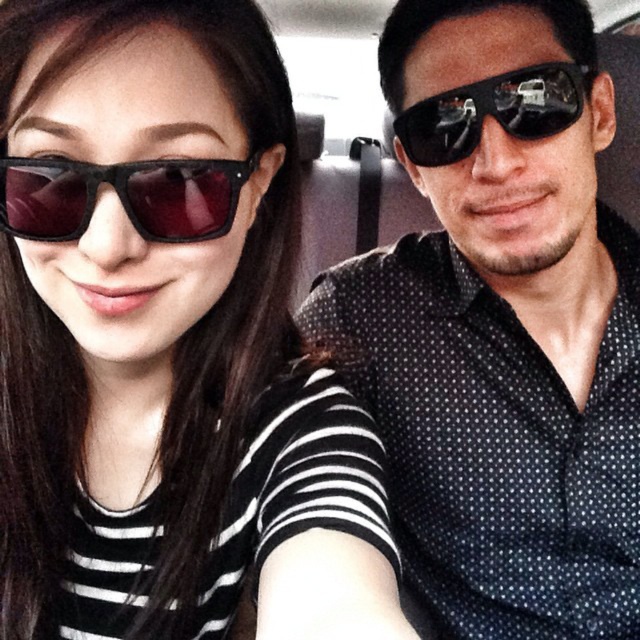
Question: Which point is farther from the camera taking this photo?

Choices:
 (A) (236, 179)
 (B) (563, 180)
 (C) (416, 128)

Answer: (C)

Question: Which point is closer to the camera taking this photo?

Choices:
 (A) (184, 214)
 (B) (88, 76)
 (C) (417, 273)

Answer: (B)

Question: Which point is farther to the camera?

Choices:
 (A) (509, 102)
 (B) (60, 186)

Answer: (A)

Question: Does matte black sunglasses at upper left have a smaller size compared to black reflective sunglasses at right?

Choices:
 (A) yes
 (B) no

Answer: (B)

Question: Does matte black sunglasses at upper right appear under matte black sunglasses at left?

Choices:
 (A) no
 (B) yes

Answer: (B)

Question: Does matte black sunglasses at upper left appear under black reflective sunglasses at right?

Choices:
 (A) no
 (B) yes

Answer: (B)